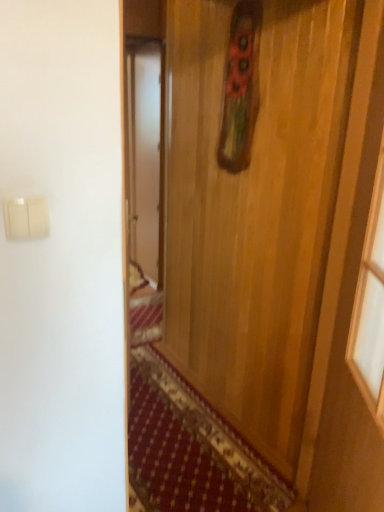
Question: From the image's perspective, is wooden door at center on white plastic light switch at upper left?

Choices:
 (A) yes
 (B) no

Answer: (B)

Question: Considering the relative sizes of wooden door at center and white plastic light switch at upper left in the image provided, is wooden door at center taller than white plastic light switch at upper left?

Choices:
 (A) no
 (B) yes

Answer: (B)

Question: Is wooden door at center closer to camera compared to white plastic light switch at upper left?

Choices:
 (A) yes
 (B) no

Answer: (B)

Question: Does wooden door at center contain white plastic light switch at upper left?

Choices:
 (A) yes
 (B) no

Answer: (B)

Question: Is wooden door at center not inside white plastic light switch at upper left?

Choices:
 (A) no
 (B) yes

Answer: (B)

Question: Is wooden door at center to the left of white plastic light switch at upper left from the viewer's perspective?

Choices:
 (A) no
 (B) yes

Answer: (A)

Question: Is white plastic light switch at upper left aimed at wooden door at center?

Choices:
 (A) no
 (B) yes

Answer: (A)

Question: Is white plastic light switch at upper left not within wooden door at center?

Choices:
 (A) yes
 (B) no

Answer: (A)

Question: Does white plastic light switch at upper left lie behind wooden door at center?

Choices:
 (A) yes
 (B) no

Answer: (B)

Question: From a real-world perspective, is white plastic light switch at upper left located beneath wooden door at center?

Choices:
 (A) yes
 (B) no

Answer: (B)

Question: From the image's perspective, does white plastic light switch at upper left appear higher than wooden door at center?

Choices:
 (A) yes
 (B) no

Answer: (A)

Question: Does white plastic light switch at upper left have a smaller size compared to wooden door at center?

Choices:
 (A) yes
 (B) no

Answer: (A)

Question: In the image, is white plastic light switch at upper left positioned in front of or behind wooden door at center?

Choices:
 (A) front
 (B) behind

Answer: (A)